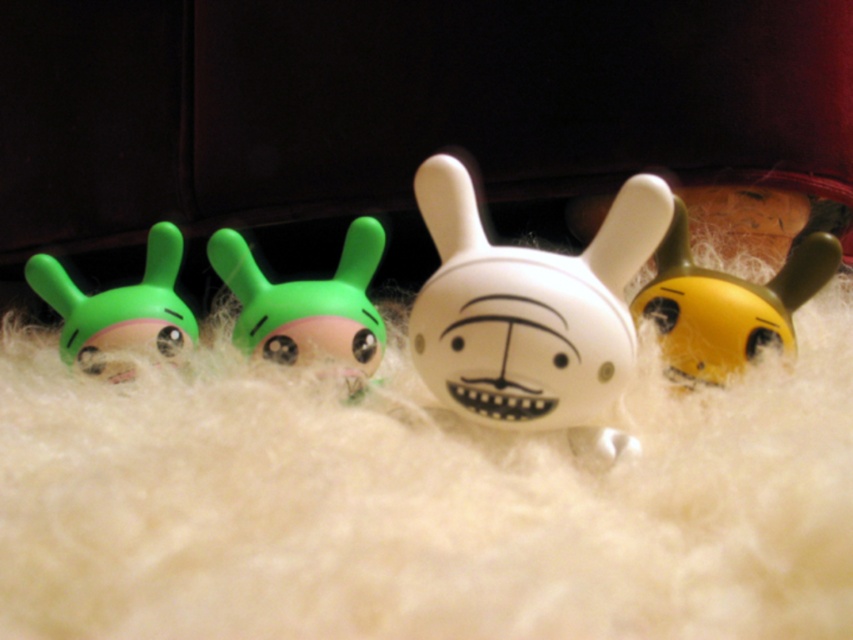
You are organizing a display of toys on a shelf. You have a white matte face at center and a green matte toy at left. Which toy should you place on the right side of the shelf to match the original arrangement?

The white matte face at center should be placed on the right side of the shelf because it was originally positioned to the right of the green matte toy at left in the image.

You are organizing a display and need to place the white matte rabbit at center and the matte green rabbit at center side by side. Which rabbit requires more horizontal space for proper placement?

The white matte rabbit at center requires more horizontal space because its width surpasses that of the matte green rabbit at center.